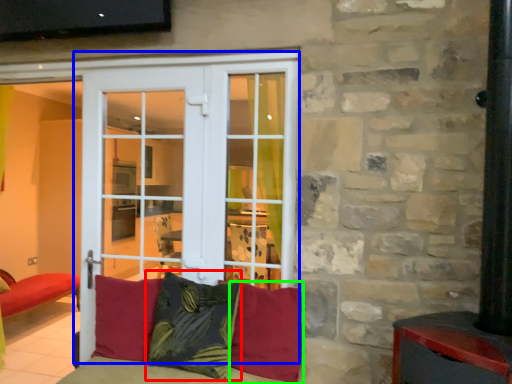
Question: Based on their relative distances, which object is farther from pillow (highlighted by a red box)? Choose from door (highlighted by a blue box) and pillow (highlighted by a green box).

Choices:
 (A) door
 (B) pillow

Answer: (A)